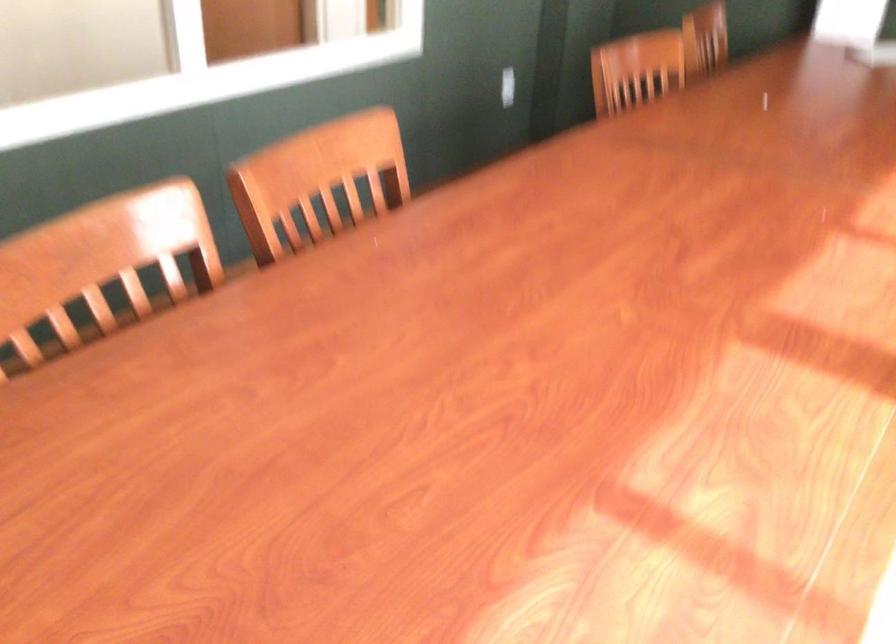
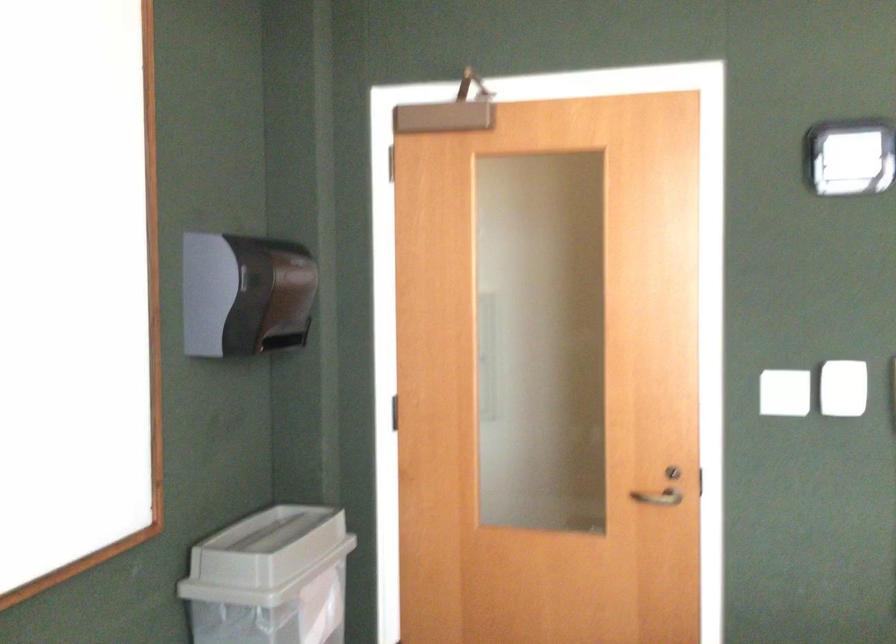
Question: The images are taken continuously from a first-person perspective. In which direction is your viewpoint rotating?

Choices:
 (A) Left
 (B) Right
 (C) Up
 (D) Down

Answer: (A)